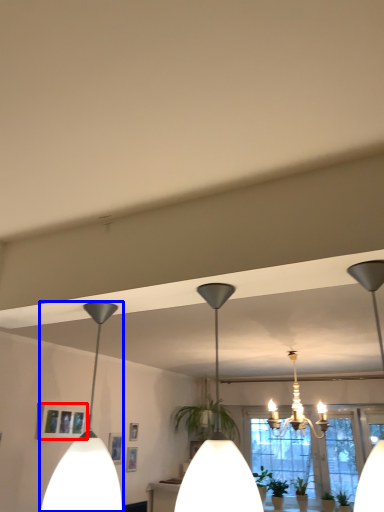
Question: Among these objects, which one is farthest to the camera, picture frame (highlighted by a red box) or lamp (highlighted by a blue box)?

Choices:
 (A) picture frame
 (B) lamp

Answer: (A)